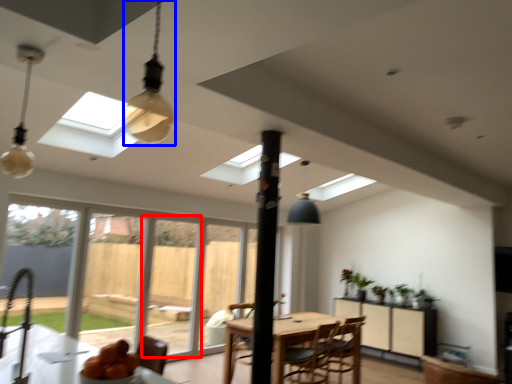
Question: Which point is further to the camera, screen door (highlighted by a red box) or light fixture (highlighted by a blue box)?

Choices:
 (A) screen door
 (B) light fixture

Answer: (A)